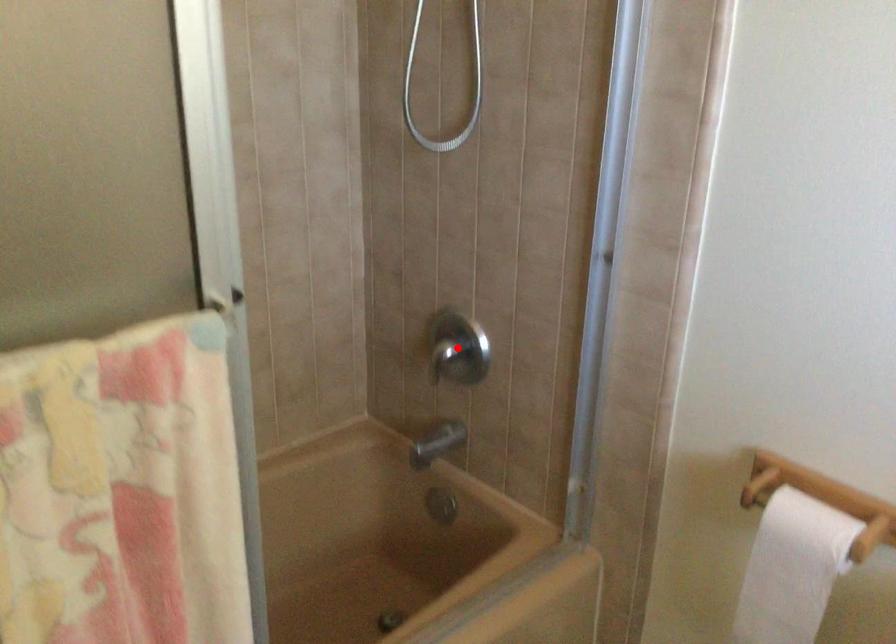
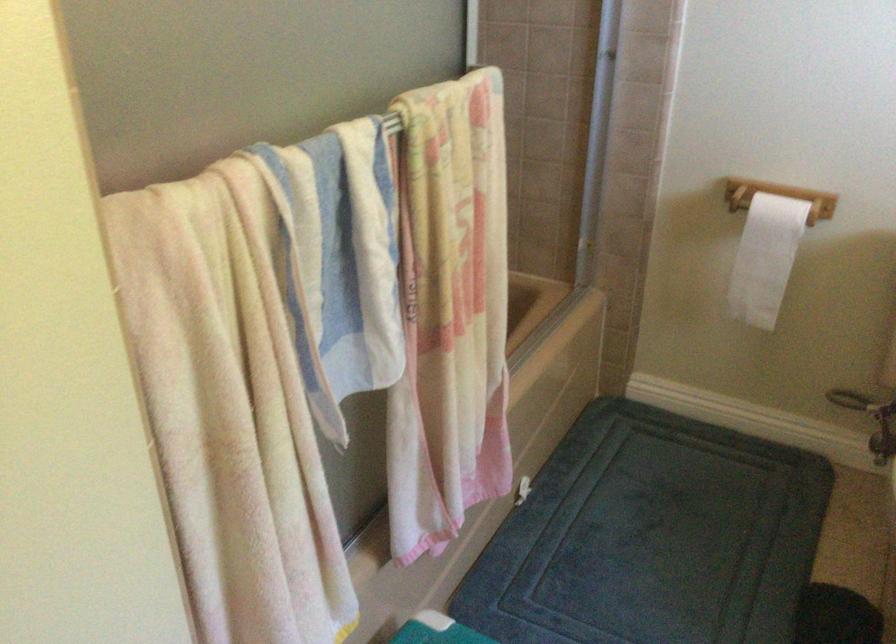
Question: I am providing you with two images of the same scene from different viewpoints. A red point is marked on the first image. At the location where the point appears in image 1, is it still visible in image 2?

Choices:
 (A) Yes
 (B) No

Answer: (B)